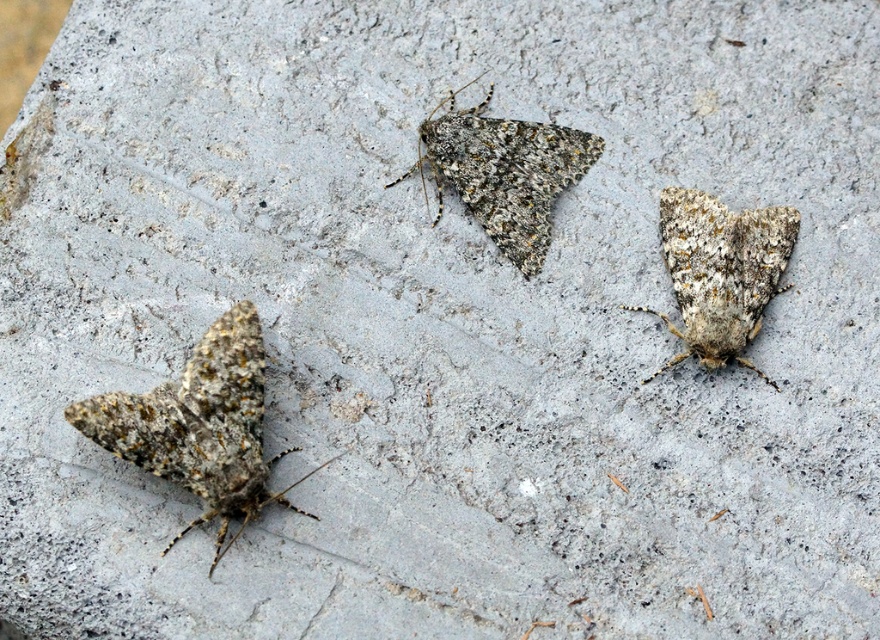
Question: In this image, where is speckled brown moth at lower left located relative to speckled brown moth at center?

Choices:
 (A) right
 (B) left

Answer: (B)

Question: Does speckled brown moth at lower left have a larger size compared to speckled brown moth at center?

Choices:
 (A) yes
 (B) no

Answer: (A)

Question: Among these points, which one is farthest from the camera?

Choices:
 (A) (673, 236)
 (B) (246, 339)

Answer: (A)

Question: Which object appears farthest from the camera in this image?

Choices:
 (A) speckled brown moth at center
 (B) speckled brown moth at right

Answer: (A)

Question: From the image, what is the correct spatial relationship of speckled brown moth at lower left in relation to speckled brown moth at right?

Choices:
 (A) below
 (B) above

Answer: (A)

Question: Which of the following is the farthest from the observer?

Choices:
 (A) speckled brown moth at right
 (B) speckled brown moth at lower left
 (C) speckled brown moth at center

Answer: (C)